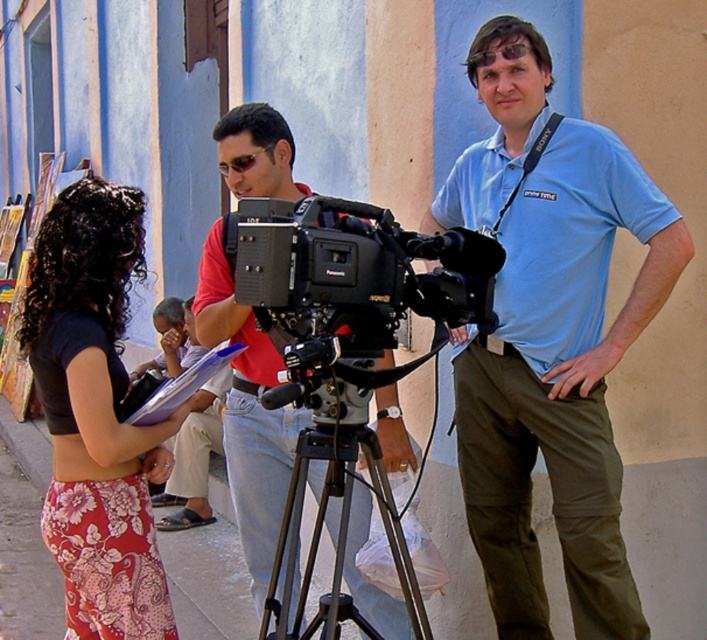
Question: Among these objects, which one is farthest from the camera?

Choices:
 (A) red matte camera at center
 (B) floral cotton skirt at lower left
 (C) blue cotton shirt at center
 (D) black plastic camera at center

Answer: (C)

Question: Is red matte camera at center in front of black metal tripod at center?

Choices:
 (A) no
 (B) yes

Answer: (A)

Question: Does floral cotton skirt at lower left have a greater width compared to red matte camera at center?

Choices:
 (A) no
 (B) yes

Answer: (A)

Question: Which object is the closest to the red matte camera at center?

Choices:
 (A) black plastic camera at center
 (B) blue cotton shirt at center

Answer: (B)

Question: Among these objects, which one is farthest from the camera?

Choices:
 (A) black metal tripod at center
 (B) red matte camera at center

Answer: (B)

Question: Does blue cotton shirt at center appear on the right side of black metal tripod at center?

Choices:
 (A) no
 (B) yes

Answer: (B)